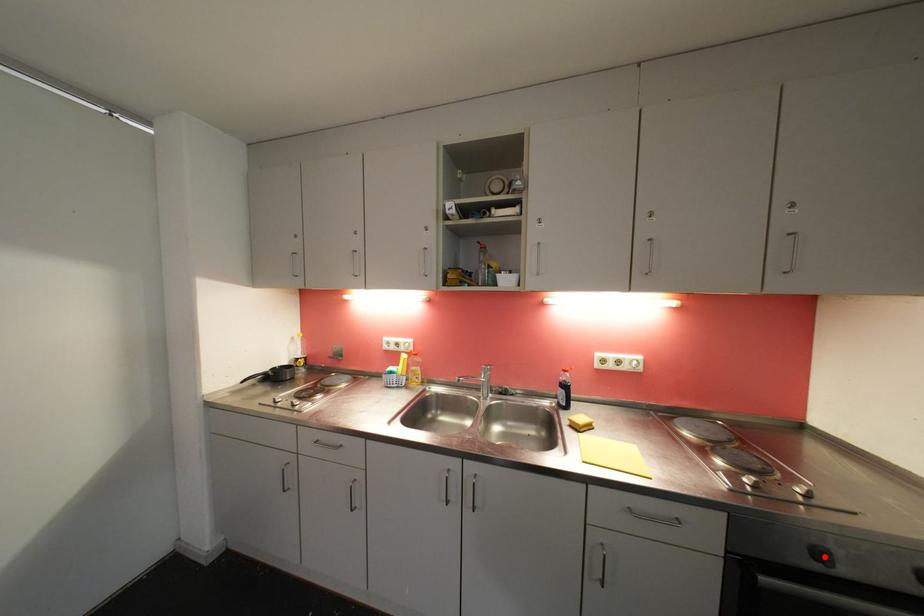
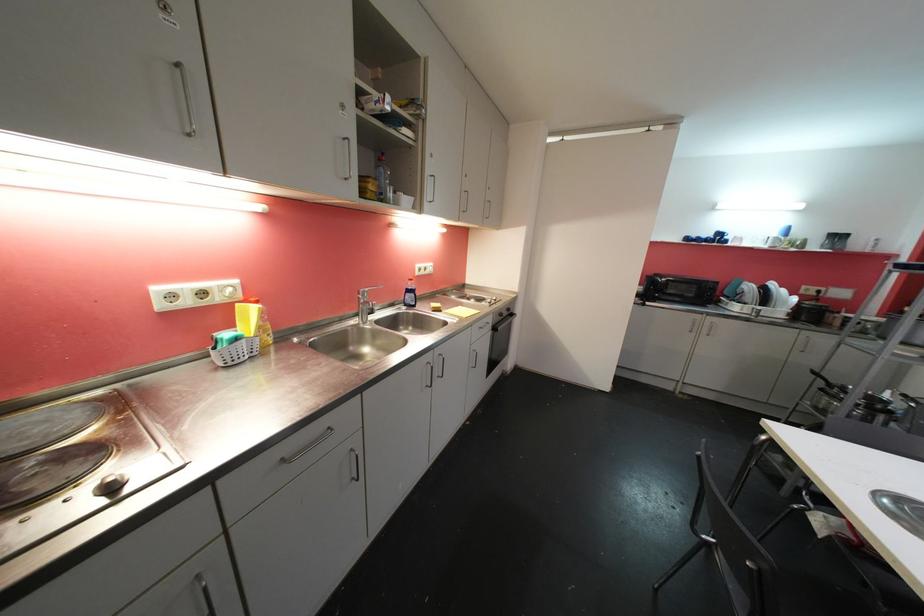
In the second image, find the point that corresponds to the highlighted location in the first image.

(505, 317)